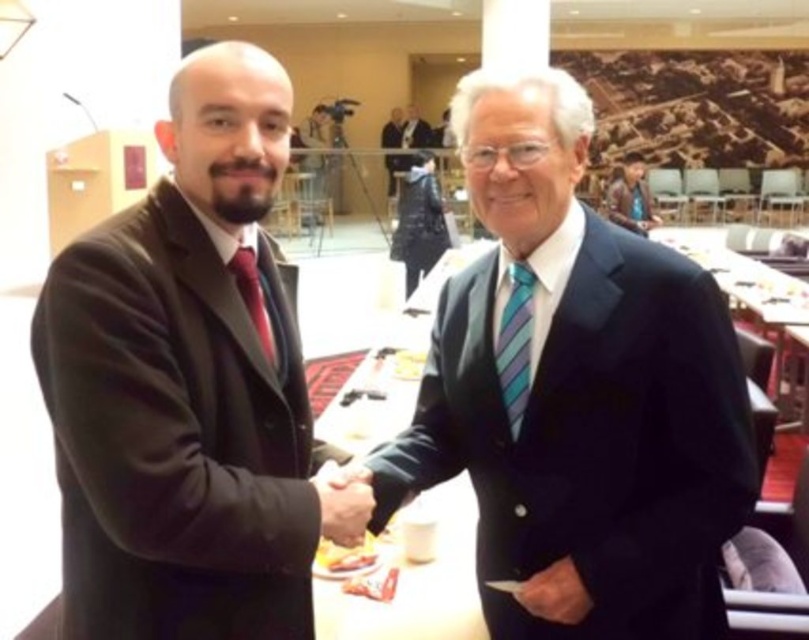
Question: Is matte red tie at center above dark blue suit at center?

Choices:
 (A) yes
 (B) no

Answer: (B)

Question: Is the position of matte black hand at center more distant than that of brown leather jacket at upper right?

Choices:
 (A) yes
 (B) no

Answer: (B)

Question: Which point appears farthest from the camera in this image?

Choices:
 (A) (522, 288)
 (B) (392, 157)
 (C) (253, 275)

Answer: (B)

Question: Which object is the farthest from the dark blue suit at center?

Choices:
 (A) brown leather jacket at upper right
 (B) smooth leather hand at center
 (C) matte black suit at left

Answer: (B)

Question: Can you confirm if matte black suit at left is positioned to the right of matte black hand at center?

Choices:
 (A) no
 (B) yes

Answer: (A)

Question: Which object is positioned farthest from the matte red tie at center?

Choices:
 (A) smooth leather hand at center
 (B) striped fabric tie at right
 (C) matte black suit at center
 (D) brown leather jacket at upper right

Answer: (D)